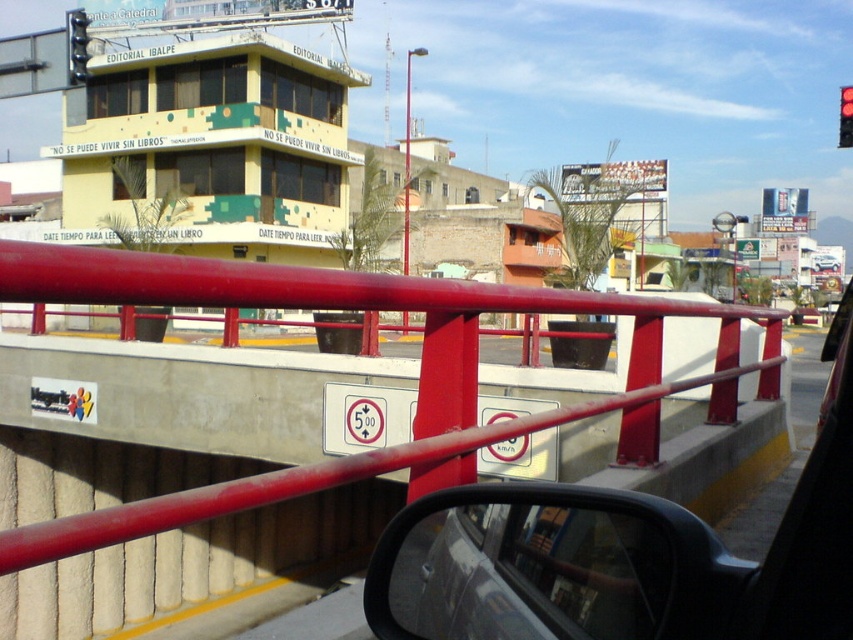
Question: Which of the following is the farthest from the observer?

Choices:
 (A) red glass traffic light at upper right
 (B) black glossy car at center

Answer: (A)

Question: Considering the relative positions of red metal/rail at center and metallic pole at center in the image provided, where is red metal/rail at center located with respect to metallic pole at center?

Choices:
 (A) below
 (B) above

Answer: (A)

Question: Can you confirm if red metal/rail at center is thinner than metallic pole at center?

Choices:
 (A) yes
 (B) no

Answer: (B)

Question: Which object is the farthest from the red metal/rail at center?

Choices:
 (A) black glossy car at center
 (B) red glass traffic light at upper right
 (C) metallic traffic light at upper left
 (D) metallic pole at center

Answer: (C)

Question: Considering the real-world distances, which object is farthest from the red metal/rail at center?

Choices:
 (A) metallic traffic light at upper left
 (B) black glossy car at center
 (C) metallic pole at center

Answer: (A)

Question: Does metallic pole at center appear over red glass traffic light at upper right?

Choices:
 (A) yes
 (B) no

Answer: (B)